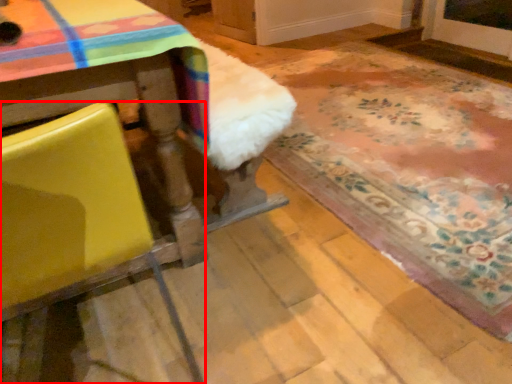
Question: From the image's perspective, where is chair (annotated by the red box) located relative to mat?

Choices:
 (A) above
 (B) below

Answer: (B)